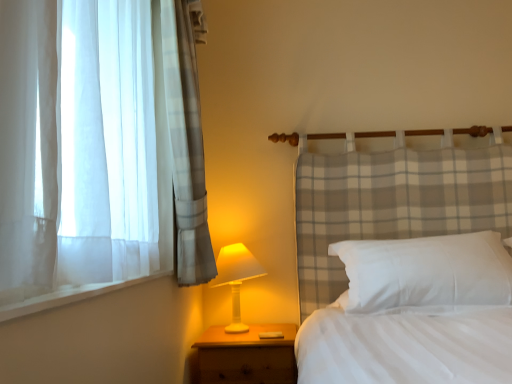
Question: Is the depth of white plastic table lamp at lower center greater than that of white soft pillow at center?

Choices:
 (A) yes
 (B) no

Answer: (A)

Question: Considering the relative positions of white plastic table lamp at lower center and white soft pillow at center in the image provided, is white plastic table lamp at lower center to the left of white soft pillow at center from the viewer's perspective?

Choices:
 (A) no
 (B) yes

Answer: (B)

Question: Is white plastic table lamp at lower center completely or partially outside of white soft pillow at center?

Choices:
 (A) no
 (B) yes

Answer: (B)

Question: From the image's perspective, is white plastic table lamp at lower center under white soft pillow at center?

Choices:
 (A) no
 (B) yes

Answer: (B)

Question: Is white plastic table lamp at lower center smaller than white soft pillow at center?

Choices:
 (A) no
 (B) yes

Answer: (B)

Question: From the image's perspective, relative to white soft pillow at center, is wooden nightstand at lower left above or below?

Choices:
 (A) below
 (B) above

Answer: (A)

Question: Based on their sizes in the image, would you say wooden nightstand at lower left is bigger or smaller than white soft pillow at center?

Choices:
 (A) small
 (B) big

Answer: (A)

Question: From a real-world perspective, is wooden nightstand at lower left physically located above or below white soft pillow at center?

Choices:
 (A) below
 (B) above

Answer: (A)

Question: Does point (253, 336) appear closer or farther from the camera than point (417, 251)?

Choices:
 (A) closer
 (B) farther

Answer: (B)

Question: Looking at their shapes, would you say white plastic table lamp at lower center is wider or thinner than wooden nightstand at lower left?

Choices:
 (A) thin
 (B) wide

Answer: (A)

Question: Based on their sizes in the image, would you say white plastic table lamp at lower center is bigger or smaller than wooden nightstand at lower left?

Choices:
 (A) small
 (B) big

Answer: (A)

Question: Relative to wooden nightstand at lower left, is white plastic table lamp at lower center in front or behind?

Choices:
 (A) front
 (B) behind

Answer: (B)

Question: Is white plastic table lamp at lower center situated inside wooden nightstand at lower left or outside?

Choices:
 (A) outside
 (B) inside

Answer: (A)

Question: Considering the positions of white soft pillow at center and white plastic table lamp at lower center in the image, is white soft pillow at center taller or shorter than white plastic table lamp at lower center?

Choices:
 (A) short
 (B) tall

Answer: (A)

Question: Is white soft pillow at center inside or outside of white plastic table lamp at lower center?

Choices:
 (A) outside
 (B) inside

Answer: (A)